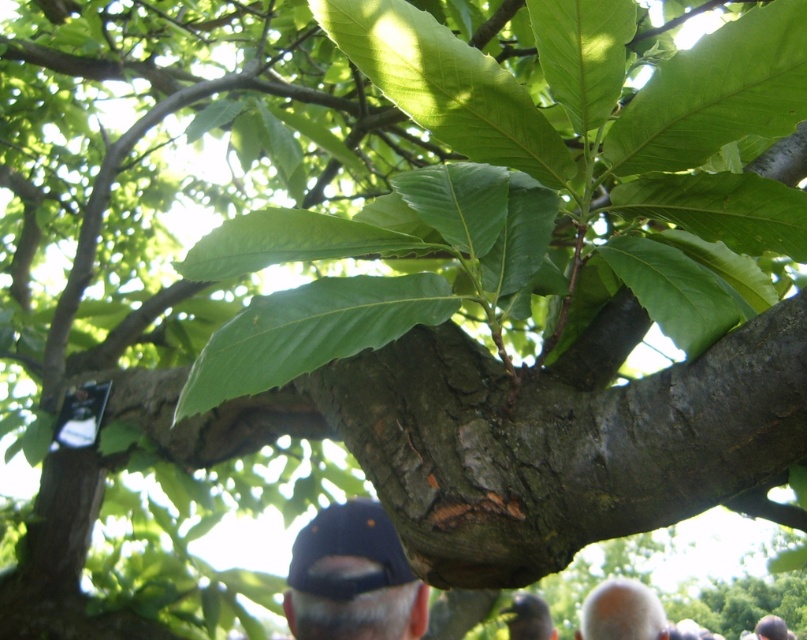
Between dark blue fabric baseball cap at lower center and gray matte cap at upper center, which one has more height?

Standing taller between the two is gray matte cap at upper center.

Which is behind, point (324, 577) or point (515, 602)?

Point (515, 602)

Find the location of a particular element. The width and height of the screenshot is (807, 640). dark blue fabric baseball cap at lower center is located at coordinates (348, 550).

Can you confirm if dark blue fabric baseball cap at lower center is shorter than bald head at lower right?

Indeed, dark blue fabric baseball cap at lower center has a lesser height compared to bald head at lower right.

Between point (392, 564) and point (630, 625), which one is positioned in front?

Point (392, 564)

Who is more forward, (287,566) or (663,624)?

Point (287,566) is more forward.

Identify the location of dark blue fabric baseball cap at lower center. Image resolution: width=807 pixels, height=640 pixels. (348, 550).

Is bald head at lower right wider than gray matte cap at upper center?

Yes.

Does point (657, 634) come farther from viewer compared to point (536, 636)?

Yes, it is behind point (536, 636).

The height and width of the screenshot is (640, 807). Find the location of `bald head at lower right`. bald head at lower right is located at coordinates (622, 611).